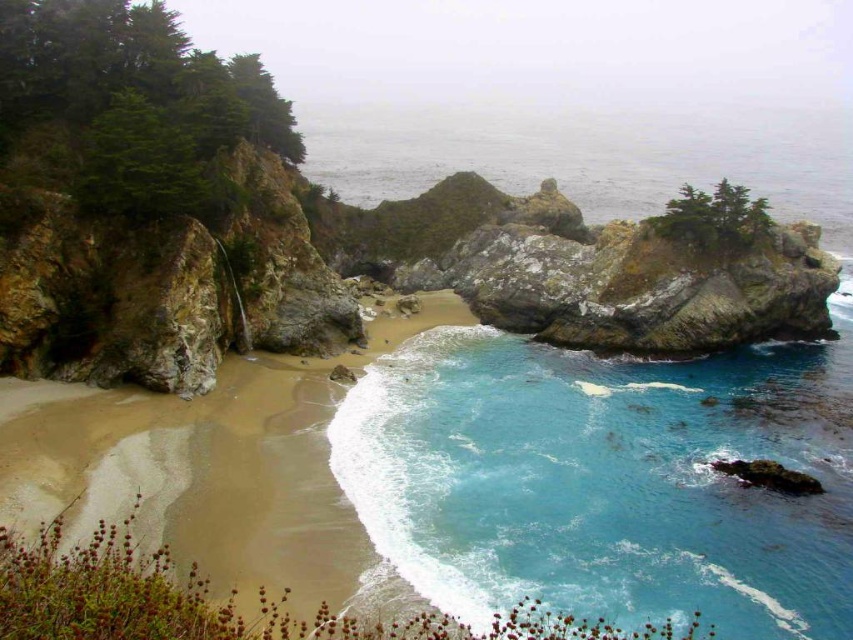
Image resolution: width=853 pixels, height=640 pixels. Describe the element at coordinates (606, 480) in the screenshot. I see `blue smooth water at center` at that location.

Can you confirm if blue smooth water at center is positioned above sandy beach at center?

No.

Is point (651, 422) less distant than point (357, 358)?

Yes, point (651, 422) is in front of point (357, 358).

At what (x,y) coordinates should I click in order to perform the action: click on blue smooth water at center. Please return your answer as a coordinate pair (x, y). Looking at the image, I should click on (606, 480).